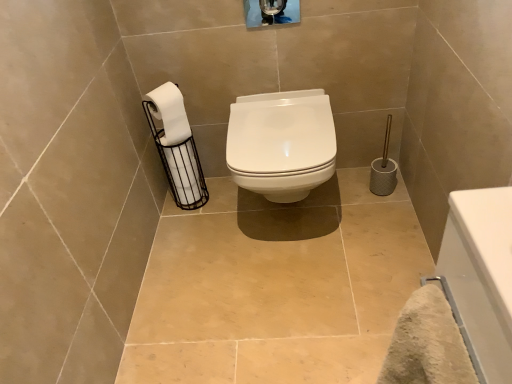
Question: Could white matte toilet paper at left, positioned as the 1th toilet paper in back-to-front order, be considered to be inside white glossy toilet at center?

Choices:
 (A) no
 (B) yes

Answer: (A)

Question: Is white glossy toilet at center positioned beyond the bounds of white matte toilet paper at left, the 2th toilet paper viewed from the front?

Choices:
 (A) yes
 (B) no

Answer: (A)

Question: Is white matte toilet paper at left, positioned as the 1th toilet paper in back-to-front order, at the back of white glossy toilet at center?

Choices:
 (A) no
 (B) yes

Answer: (A)

Question: From the image's perspective, is white glossy toilet at center on top of white matte toilet paper at left, positioned as the 1th toilet paper in back-to-front order?

Choices:
 (A) yes
 (B) no

Answer: (A)

Question: Considering the relative sizes of white glossy toilet at center and white matte toilet paper at left, positioned as the 1th toilet paper in back-to-front order, in the image provided, is white glossy toilet at center wider than white matte toilet paper at left, positioned as the 1th toilet paper in back-to-front order,?

Choices:
 (A) yes
 (B) no

Answer: (A)

Question: Is white glossy toilet at center next to white matte toilet paper at left, positioned as the 1th toilet paper in back-to-front order, and touching it?

Choices:
 (A) yes
 (B) no

Answer: (B)

Question: Considering the relative sizes of white matte toilet paper at left, which is counted as the second toilet paper, starting from the back, and white glossy toilet at center in the image provided, is white matte toilet paper at left, which is counted as the second toilet paper, starting from the back, taller than white glossy toilet at center?

Choices:
 (A) no
 (B) yes

Answer: (A)

Question: From the image's perspective, is white matte toilet paper at left, marked as the first toilet paper in a front-to-back arrangement, under white glossy toilet at center?

Choices:
 (A) no
 (B) yes

Answer: (A)

Question: Can you confirm if white matte toilet paper at left, marked as the first toilet paper in a front-to-back arrangement, is thinner than white glossy toilet at center?

Choices:
 (A) no
 (B) yes

Answer: (B)

Question: From a real-world perspective, does white matte toilet paper at left, marked as the first toilet paper in a front-to-back arrangement, sit lower than white glossy toilet at center?

Choices:
 (A) no
 (B) yes

Answer: (A)

Question: Can you confirm if white matte toilet paper at left, marked as the first toilet paper in a front-to-back arrangement, is positioned to the left of white glossy toilet at center?

Choices:
 (A) yes
 (B) no

Answer: (A)

Question: Are white matte toilet paper at left, marked as the first toilet paper in a front-to-back arrangement, and white glossy toilet at center beside each other?

Choices:
 (A) no
 (B) yes

Answer: (A)

Question: From the image's perspective, would you say white glossy toilet at center is positioned over white glossy bathtub at lower right?

Choices:
 (A) no
 (B) yes

Answer: (B)